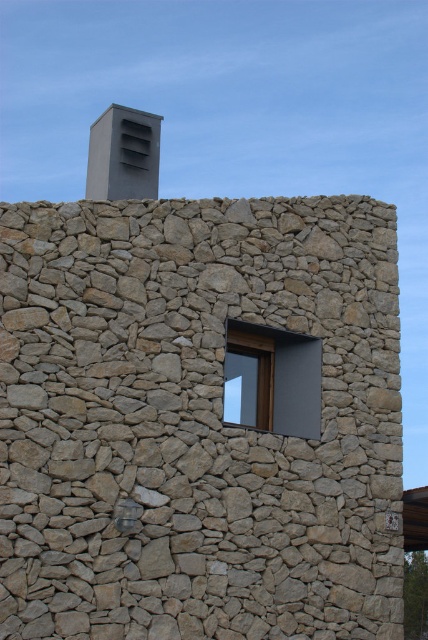
Does matte gray window at center have a greater height compared to gray matte chimney at upper center?

No.

Can you confirm if matte gray window at center is positioned to the left of gray matte chimney at upper center?

No, matte gray window at center is not to the left of gray matte chimney at upper center.

Between point (315, 394) and point (104, 148), which one is positioned in front?

Point (315, 394) is more forward.

You are a GUI agent. You are given a task and a screenshot of the screen. Output one action in this format:
    pyautogui.click(x=<x>, y=<y>)
    Task: Click on the matte gray window at center
    This screenshot has height=640, width=428.
    Given the screenshot: What is the action you would take?
    pyautogui.click(x=276, y=378)

Is point (124, 241) positioned before point (142, 160)?

Yes.

Which is more to the right, natural stone wall at center or gray matte chimney at upper center?

natural stone wall at center is more to the right.

Where is `natural stone wall at center`? The width and height of the screenshot is (428, 640). natural stone wall at center is located at coordinates (199, 420).

This screenshot has height=640, width=428. Identify the location of natural stone wall at center. (199, 420).

Can you confirm if natural stone wall at center is positioned below matte gray window at center?

Yes.

Does point (262, 300) lie behind point (294, 400)?

That is False.

The width and height of the screenshot is (428, 640). Identify the location of natural stone wall at center. tap(199, 420).